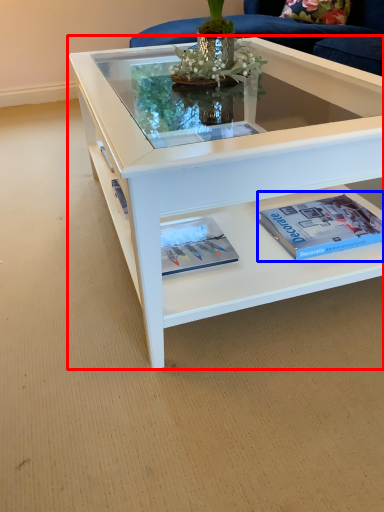
Question: Which of the following is the farthest to the observer, coffee table (highlighted by a red box) or paperback book (highlighted by a blue box)?

Choices:
 (A) coffee table
 (B) paperback book

Answer: (B)